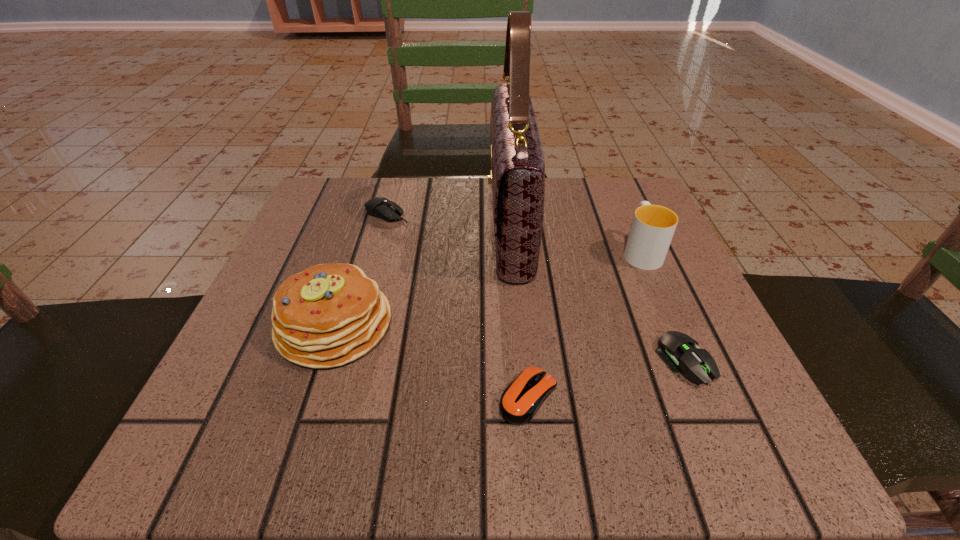
This screenshot has width=960, height=540. Identify the location of free space located with the handle on the side of the cup. (616, 194).

Locate an element on the screen. free point located with the handle on the side of the cup is located at coordinates (611, 180).

You are a GUI agent. You are given a task and a screenshot of the screen. Output one action in this format:
    pyautogui.click(x=<x>, y=<y>)
    Task: Click on the free location located 0.050m on the right of the pancake
    This screenshot has width=960, height=540.
    Given the screenshot: What is the action you would take?
    pyautogui.click(x=422, y=325)

Identify the location of vacant space located on the right of the farthest computer mouse. This screenshot has width=960, height=540. (557, 214).

Locate an element on the screen. This screenshot has width=960, height=540. vacant area situated on the left of the second computer mouse from right to left is located at coordinates (447, 396).

This screenshot has width=960, height=540. What are the coordinates of `vacant area situated on the left of the rightmost computer mouse` in the screenshot? It's located at (x=462, y=361).

Locate an element on the screen. handbag situated at the far edge is located at coordinates (517, 176).

Where is `cup at the far edge`? This screenshot has width=960, height=540. cup at the far edge is located at coordinates (653, 226).

Identify the location of computer mouse at the far edge. The height and width of the screenshot is (540, 960). (383, 208).

You are a GUI agent. You are given a task and a screenshot of the screen. Output one action in this format:
    pyautogui.click(x=<x>, y=<y>)
    Task: Click on the object that is at the near edge
    This screenshot has width=960, height=540.
    Given the screenshot: What is the action you would take?
    pyautogui.click(x=521, y=400)